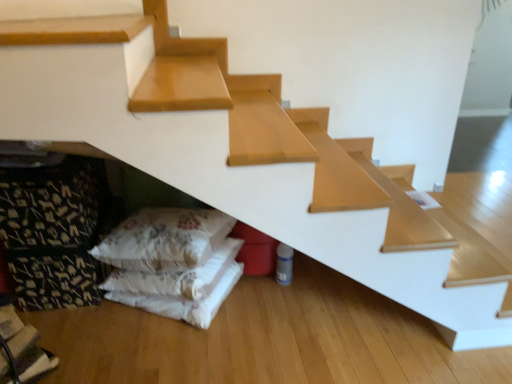
Describe the element at coordinates (164, 239) in the screenshot. I see `fluffy white pillow at lower left` at that location.

The image size is (512, 384). Identify the location of fluffy white pillow at lower left. (164, 239).

What do you see at coordinates (185, 300) in the screenshot?
I see `white fabric pillows at lower left` at bounding box center [185, 300].

Identify the location of white fabric pillows at lower left. (185, 300).

Locate an element on the screen. This screenshot has width=512, height=384. fluffy white pillow at lower left is located at coordinates (164, 239).

Between fluffy white pillow at lower left and white fabric pillows at lower left, which one appears on the left side from the viewer's perspective?

white fabric pillows at lower left.

Who is more distant, fluffy white pillow at lower left or white fabric pillows at lower left?

white fabric pillows at lower left is behind.

Considering the positions of points (126, 263) and (170, 298), is point (126, 263) closer to camera compared to point (170, 298)?

Yes, it is in front of point (170, 298).

From the image's perspective, is fluffy white pillow at lower left beneath white fabric pillows at lower left?

Actually, fluffy white pillow at lower left appears above white fabric pillows at lower left in the image.

Looking at this image, from a real-world perspective, is fluffy white pillow at lower left under white fabric pillows at lower left?

No.

Which object is thinner, fluffy white pillow at lower left or white fabric pillows at lower left?

Thinner between the two is fluffy white pillow at lower left.

Which of these two, fluffy white pillow at lower left or white fabric pillows at lower left, stands shorter?

white fabric pillows at lower left is shorter.

Considering the sizes of objects fluffy white pillow at lower left and white fabric pillows at lower left in the image provided, who is smaller, fluffy white pillow at lower left or white fabric pillows at lower left?

white fabric pillows at lower left is smaller.

Could white fabric pillows at lower left be considered to be inside fluffy white pillow at lower left?

No, white fabric pillows at lower left is not a part of fluffy white pillow at lower left.

Is the surface of fluffy white pillow at lower left in direct contact with white fabric pillows at lower left?

fluffy white pillow at lower left is not next to white fabric pillows at lower left, and they're not touching.

Could you tell me if fluffy white pillow at lower left is turned towards white fabric pillows at lower left?

No, fluffy white pillow at lower left is not aimed at white fabric pillows at lower left.

This screenshot has height=384, width=512. I want to click on pillow in front of the white fabric pillows at lower left, so click(x=164, y=239).

Which object is positioned more to the right, white fabric pillows at lower left or fluffy white pillow at lower left?

Positioned to the right is fluffy white pillow at lower left.

Who is more distant, white fabric pillows at lower left or fluffy white pillow at lower left?

white fabric pillows at lower left is further from the camera.

Is point (228, 270) closer or farther from the camera than point (126, 224)?

Point (228, 270) is farther from the camera than point (126, 224).

From the image's perspective, is white fabric pillows at lower left below fluffy white pillow at lower left?

Yes, from the image's perspective, white fabric pillows at lower left is below fluffy white pillow at lower left.

From a real-world perspective, who is located higher, white fabric pillows at lower left or fluffy white pillow at lower left?

fluffy white pillow at lower left is physically above.

Can you confirm if white fabric pillows at lower left is wider than fluffy white pillow at lower left?

Indeed, white fabric pillows at lower left has a greater width compared to fluffy white pillow at lower left.

Is white fabric pillows at lower left shorter than fluffy white pillow at lower left?

Correct, white fabric pillows at lower left is not as tall as fluffy white pillow at lower left.

Based on the photo, considering the sizes of objects white fabric pillows at lower left and fluffy white pillow at lower left in the image provided, who is smaller, white fabric pillows at lower left or fluffy white pillow at lower left?

With smaller size is white fabric pillows at lower left.

Is fluffy white pillow at lower left completely or partially inside white fabric pillows at lower left?

No, fluffy white pillow at lower left is not surrounded by white fabric pillows at lower left.

Would you consider white fabric pillows at lower left to be distant from fluffy white pillow at lower left?

No, white fabric pillows at lower left is in close proximity to fluffy white pillow at lower left.

Is white fabric pillows at lower left facing towards fluffy white pillow at lower left?

No, white fabric pillows at lower left is not turned towards fluffy white pillow at lower left.

What's the angular difference between white fabric pillows at lower left and fluffy white pillow at lower left's facing directions?

The facing directions of white fabric pillows at lower left and fluffy white pillow at lower left are 0.00063 degrees apart.

How distant is white fabric pillows at lower left from fluffy white pillow at lower left?

white fabric pillows at lower left is 9.60 inches from fluffy white pillow at lower left.

Where is `sheet below the fluffy white pillow at lower left (from a real-world perspective)`? The image size is (512, 384). sheet below the fluffy white pillow at lower left (from a real-world perspective) is located at coordinates (185, 300).

I want to click on pillow on the right side of white fabric pillows at lower left, so click(x=164, y=239).

Locate an element on the screen. pillow in front of the white fabric pillows at lower left is located at coordinates (164, 239).